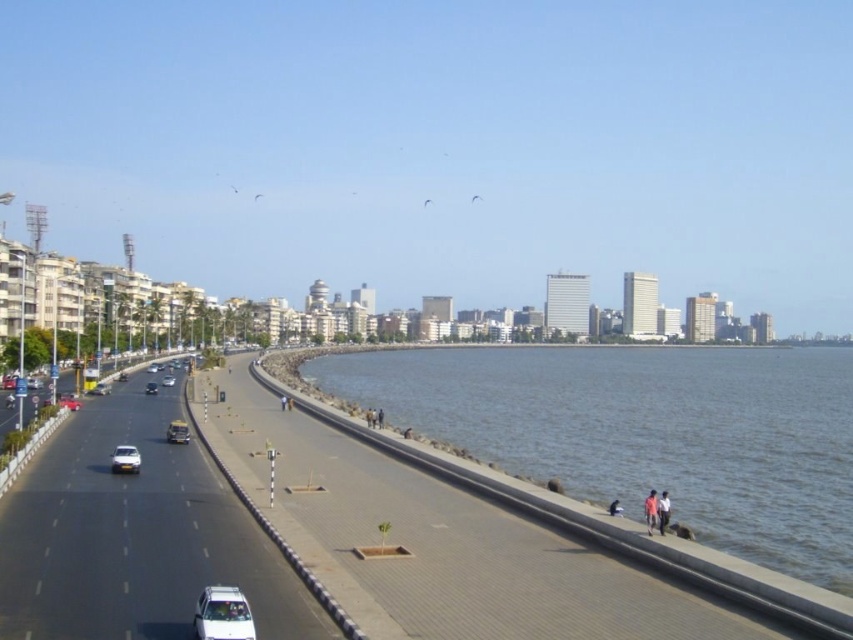
Who is taller, white glossy car at lower left or shiny silver car at center-left?

Standing taller between the two is white glossy car at lower left.

Is white glossy car at lower left smaller than shiny silver car at center-left?

Yes, white glossy car at lower left is smaller than shiny silver car at center-left.

What do you see at coordinates (222, 614) in the screenshot? I see `white glossy car at lower left` at bounding box center [222, 614].

At what (x,y) coordinates should I click in order to perform the action: click on white glossy car at lower left. Please return your answer as a coordinate pair (x, y). This screenshot has width=853, height=640. Looking at the image, I should click on (222, 614).

Does gray concrete water at center appear under silver metallic car at center-left?

Indeed, gray concrete water at center is positioned under silver metallic car at center-left.

Who is more forward, (515, 406) or (173, 381)?

Positioned in front is point (515, 406).

The height and width of the screenshot is (640, 853). I want to click on gray concrete water at center, so click(646, 433).

The width and height of the screenshot is (853, 640). I want to click on gray concrete water at center, so click(646, 433).

Can you confirm if metallic silver car at center-left is positioned to the left of shiny silver car at center-left?

In fact, metallic silver car at center-left is to the right of shiny silver car at center-left.

Which is more to the right, metallic silver car at center-left or shiny silver car at center-left?

metallic silver car at center-left is more to the right.

Image resolution: width=853 pixels, height=640 pixels. Find the location of `metallic silver car at center-left`. metallic silver car at center-left is located at coordinates point(177,432).

At what (x,y) coordinates should I click in order to perform the action: click on metallic silver car at center-left. Please return your answer as a coordinate pair (x, y). This screenshot has height=640, width=853. Looking at the image, I should click on (177, 432).